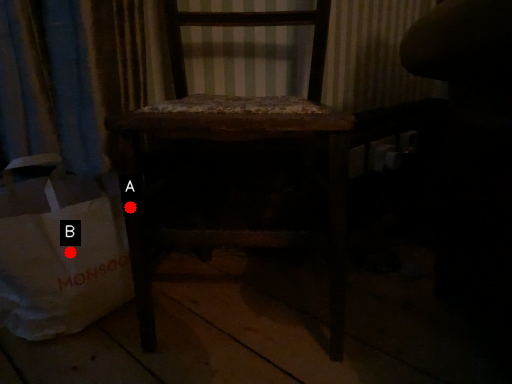
Question: Two points are circled on the image, labeled by A and B beside each circle. Which of the following is the closest to the observer?

Choices:
 (A) A is closer
 (B) B is closer

Answer: (A)